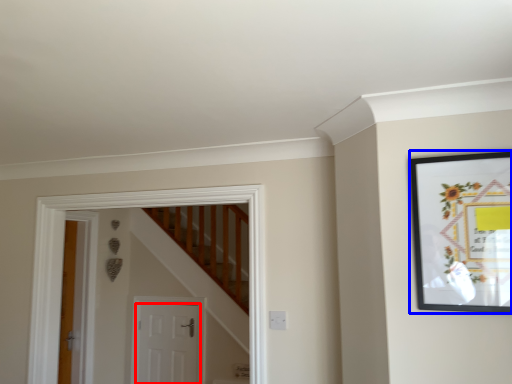
Question: Which of the following is the closest to the observer, door (highlighted by a red box) or picture frame (highlighted by a blue box)?

Choices:
 (A) door
 (B) picture frame

Answer: (B)